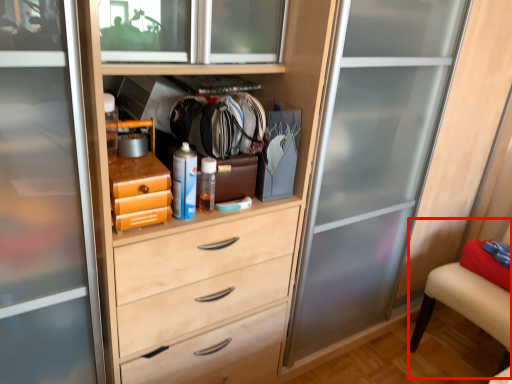
Question: From the image, what is the correct spatial relationship of armchair (annotated by the red box) in relation to bottle?

Choices:
 (A) left
 (B) right

Answer: (B)